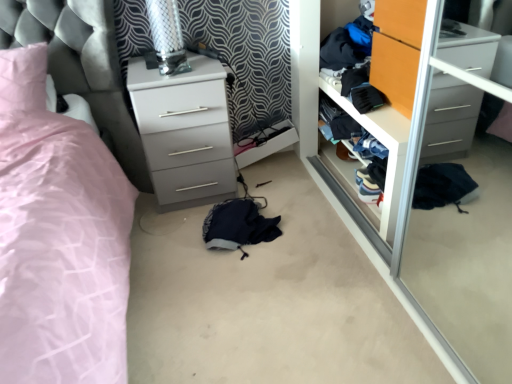
You are a GUI agent. You are given a task and a screenshot of the screen. Output one action in this format:
    pyautogui.click(x=<x>, y=<y>)
    Task: Click on the free area in between white glossy chest of drawers at center and navy blue fabric at center
    This screenshot has height=384, width=512.
    Given the screenshot: What is the action you would take?
    pyautogui.click(x=195, y=219)